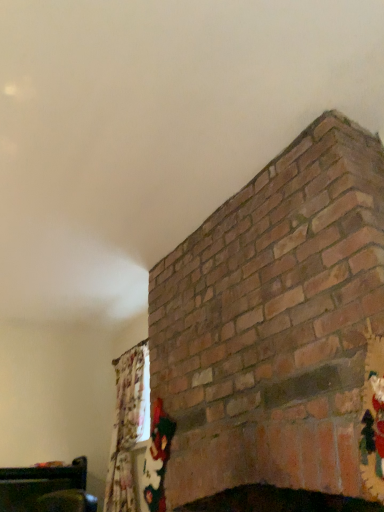
Where is `metallic gold frame at lower left`? metallic gold frame at lower left is located at coordinates (46, 489).

Describe the element at coordinates (46, 489) in the screenshot. I see `metallic gold frame at lower left` at that location.

The image size is (384, 512). Identify the location of metallic gold frame at lower left. (46, 489).